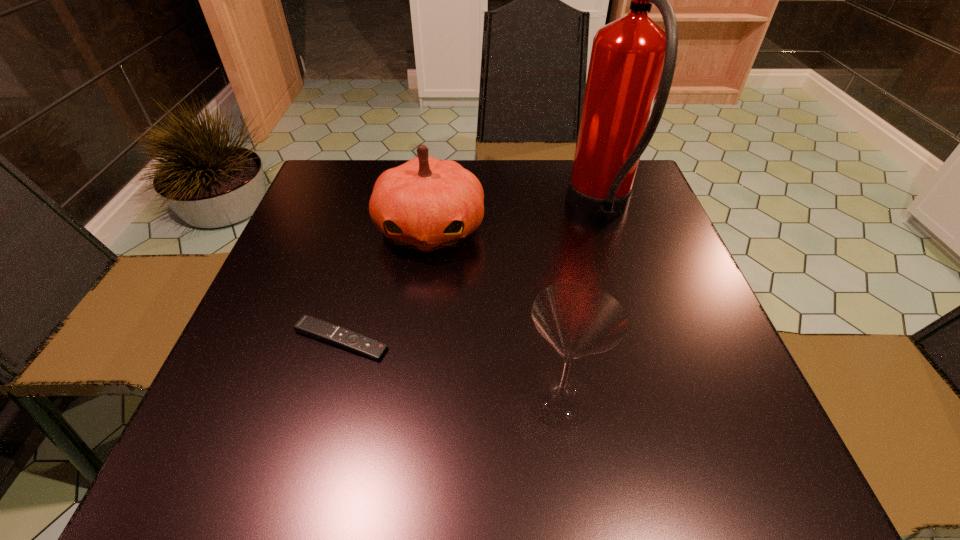
Find the location of a particular element. This screenshot has height=540, width=960. free spot that satisfies the following two spatial constraints: 1. on the front-facing side of the pumpkin; 2. on the right side of the third object from left to right is located at coordinates (409, 399).

The image size is (960, 540). Identify the location of free space that satisfies the following two spatial constraints: 1. on the front-facing side of the pumpkin; 2. on the right side of the third object from left to right. (409, 399).